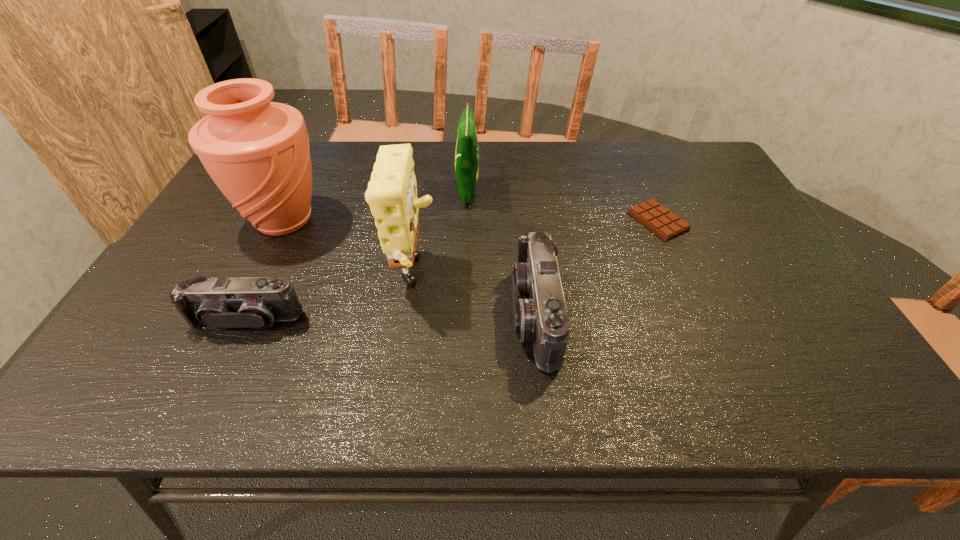
Find the location of `the second shortest object`. the second shortest object is located at coordinates (219, 303).

Locate an element on the screen. This screenshot has width=960, height=540. the left camcorder is located at coordinates (219, 303).

You are a GUI agent. You are given a task and a screenshot of the screen. Output one action in this format:
    pyautogui.click(x=<x>, y=<y>)
    Task: Click on the third shortest object
    
    Given the screenshot: What is the action you would take?
    tap(540, 315)

Locate an element on the screen. The width and height of the screenshot is (960, 540). the taller camcorder is located at coordinates (540, 315).

Identify the location of the fifth shortest object. Image resolution: width=960 pixels, height=540 pixels. (392, 192).

What are the coordinates of `the fourth object from right to left` in the screenshot? It's located at (392, 192).

The image size is (960, 540). Identify the location of candy bar. (665, 224).

This screenshot has height=540, width=960. I want to click on the rightmost object, so click(x=665, y=224).

This screenshot has height=540, width=960. Identify the location of crisp (potato chip). (466, 156).

Locate an element on the screen. The image size is (960, 540). the third tallest object is located at coordinates (466, 156).